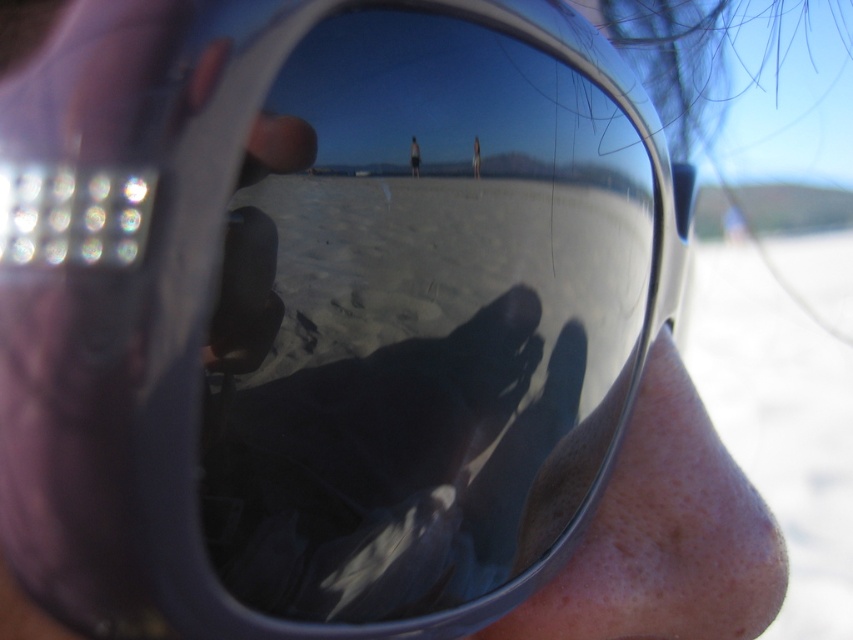
Question: Can you confirm if matte black sunglasses at center is wider than light brown skin at center?

Choices:
 (A) yes
 (B) no

Answer: (A)

Question: Which point is farther to the camera?

Choices:
 (A) light brown skin at center
 (B) matte black sunglasses at center
 (C) white sand at lower right

Answer: (C)

Question: Which point appears farthest from the camera in this image?

Choices:
 (A) (815, 461)
 (B) (477, 157)
 (C) (416, 177)
 (D) (287, 600)

Answer: (A)

Question: Can you confirm if white sand at lower right is positioned to the left of matte black sunglasses at center?

Choices:
 (A) no
 (B) yes

Answer: (A)

Question: Which object appears closest to the camera in this image?

Choices:
 (A) white sand at lower right
 (B) shiny black sunglasses at center

Answer: (B)

Question: In this image, where is shiny black sunglasses at center located relative to matte black sunglasses at center?

Choices:
 (A) right
 (B) left

Answer: (A)